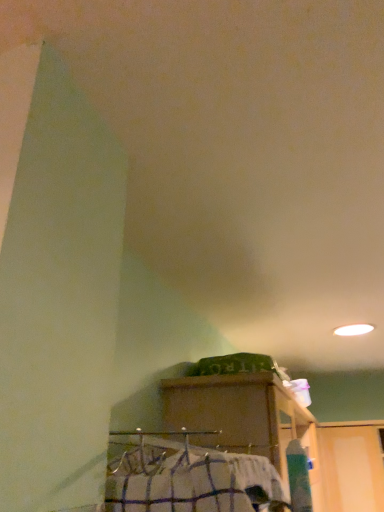
Describe the element at coordinates (241, 416) in the screenshot. I see `wooden cabinet at lower center` at that location.

Where is `wooden cabinet at lower center`? The image size is (384, 512). wooden cabinet at lower center is located at coordinates tap(241, 416).

Measure the distance between point (225, 382) and camera.

Point (225, 382) is 1.21 meters from camera.

Where is `white checkered shirt at lower center`? white checkered shirt at lower center is located at coordinates (186, 477).

Describe the element at coordinates (186, 477) in the screenshot. The height and width of the screenshot is (512, 384). I see `white checkered shirt at lower center` at that location.

Where is `wooden cabinet at lower center`? wooden cabinet at lower center is located at coordinates (241, 416).

Which object is positioned more to the right, wooden cabinet at lower center or white checkered shirt at lower center?

wooden cabinet at lower center.

Is wooden cabinet at lower center in front of or behind white checkered shirt at lower center in the image?

In the image, wooden cabinet at lower center appears behind white checkered shirt at lower center.

Which is behind, point (309, 431) or point (246, 455)?

The point (309, 431) is behind.

From the image's perspective, does wooden cabinet at lower center appear higher than white checkered shirt at lower center?

No.

From a real-world perspective, who is located higher, wooden cabinet at lower center or white checkered shirt at lower center?

wooden cabinet at lower center is physically above.

Is wooden cabinet at lower center thinner than white checkered shirt at lower center?

No, wooden cabinet at lower center is not thinner than white checkered shirt at lower center.

Can you confirm if wooden cabinet at lower center is taller than white checkered shirt at lower center?

Yes, wooden cabinet at lower center is taller than white checkered shirt at lower center.

Between wooden cabinet at lower center and white checkered shirt at lower center, which one has smaller size?

With smaller size is white checkered shirt at lower center.

Is white checkered shirt at lower center completely or partially inside wooden cabinet at lower center?

No, white checkered shirt at lower center is located outside of wooden cabinet at lower center.

Are wooden cabinet at lower center and white checkered shirt at lower center making contact?

No, wooden cabinet at lower center is not touching white checkered shirt at lower center.

Does wooden cabinet at lower center turn towards white checkered shirt at lower center?

No, wooden cabinet at lower center is not oriented towards white checkered shirt at lower center.

How much distance is there between wooden cabinet at lower center and white checkered shirt at lower center?

11.59 inches.

Find the location of `job in front of the wooden cabinet at lower center`. job in front of the wooden cabinet at lower center is located at coordinates (186, 477).

Consider the image. Considering the positions of objects white checkered shirt at lower center and wooden cabinet at lower center in the image provided, who is more to the right, white checkered shirt at lower center or wooden cabinet at lower center?

wooden cabinet at lower center is more to the right.

In the image, is white checkered shirt at lower center positioned in front of or behind wooden cabinet at lower center?

Visually, white checkered shirt at lower center is located in front of wooden cabinet at lower center.

Is point (122, 508) closer or farther from the camera than point (253, 376)?

Clearly, point (122, 508) is closer to the camera than point (253, 376).

From the image's perspective, would you say white checkered shirt at lower center is shown under wooden cabinet at lower center?

Actually, white checkered shirt at lower center appears above wooden cabinet at lower center in the image.

From a real-world perspective, who is located higher, white checkered shirt at lower center or wooden cabinet at lower center?

From a 3D spatial view, wooden cabinet at lower center is above.

Between white checkered shirt at lower center and wooden cabinet at lower center, which one has larger width?

wooden cabinet at lower center is wider.

Between white checkered shirt at lower center and wooden cabinet at lower center, which one has less height?

white checkered shirt at lower center is shorter.

Is white checkered shirt at lower center smaller than wooden cabinet at lower center?

Yes, white checkered shirt at lower center is smaller than wooden cabinet at lower center.

Is white checkered shirt at lower center not inside wooden cabinet at lower center?

Yes, white checkered shirt at lower center is outside of wooden cabinet at lower center.

Is white checkered shirt at lower center beside wooden cabinet at lower center?

No, white checkered shirt at lower center is not touching wooden cabinet at lower center.

Could you tell me if white checkered shirt at lower center is facing wooden cabinet at lower center?

No, white checkered shirt at lower center is not facing towards wooden cabinet at lower center.

What's the angular difference between white checkered shirt at lower center and wooden cabinet at lower center's facing directions?

They differ by 0.00107 degrees in their facing directions.

What are the coordinates of `job above the wooden cabinet at lower center (from the image's perspective)` in the screenshot? It's located at (186, 477).

Locate an element on the screen. furniture above the white checkered shirt at lower center (from a real-world perspective) is located at coordinates (241, 416).

I want to click on furniture that is below the white checkered shirt at lower center (from the image's perspective), so click(241, 416).